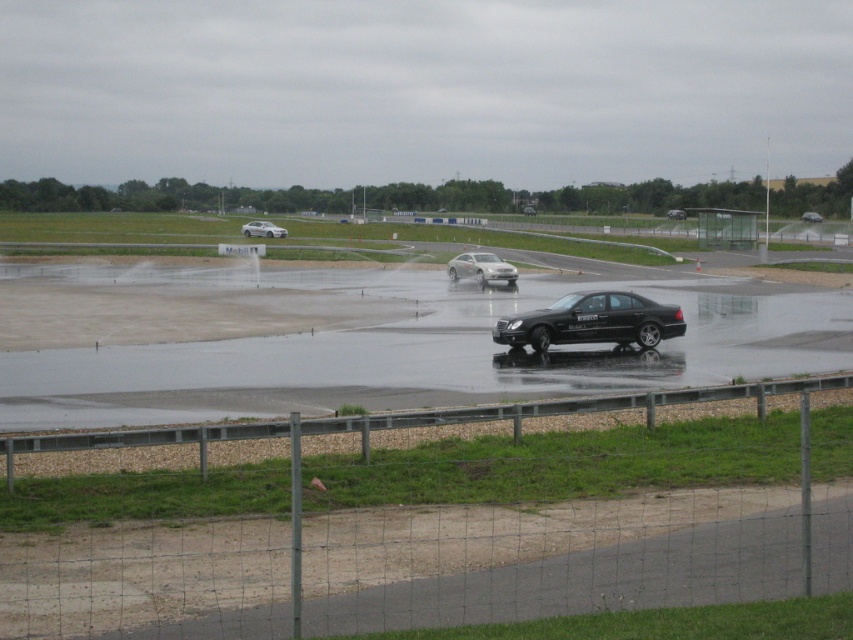
From the picture: Does satin silver sedan at left have a smaller size compared to shiny silver sedan at center?

Actually, satin silver sedan at left might be larger than shiny silver sedan at center.

Is satin silver sedan at left taller than shiny silver sedan at center?

In fact, satin silver sedan at left may be shorter than shiny silver sedan at center.

Is point (265, 227) farther from viewer compared to point (682, 209)?

No, (265, 227) is closer to viewer.

Where is `satin silver sedan at left`? The width and height of the screenshot is (853, 640). satin silver sedan at left is located at coordinates (262, 228).

Can you confirm if metallic silver sedan at center is positioned to the right of shiny silver sedan at center?

Yes, metallic silver sedan at center is to the right of shiny silver sedan at center.

Between point (815, 218) and point (677, 209), which one is positioned behind?

The point (677, 209) is more distant.

Is point (804, 211) positioned behind point (685, 218)?

Yes, it is.

Where is `metallic silver sedan at center`? The image size is (853, 640). metallic silver sedan at center is located at coordinates (811, 216).

Which is behind, point (250, 230) or point (801, 218)?

Positioned behind is point (801, 218).

Which of these two, satin silver sedan at left or metallic silver sedan at center, stands taller?

metallic silver sedan at center is taller.

Describe the element at coordinates (262, 228) in the screenshot. I see `satin silver sedan at left` at that location.

This screenshot has height=640, width=853. In order to click on satin silver sedan at left in this screenshot , I will do `click(262, 228)`.